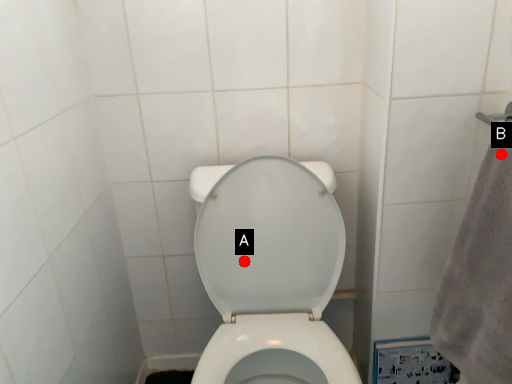
Question: Two points are circled on the image, labeled by A and B beside each circle. Which point appears closest to the camera in this image?

Choices:
 (A) A is closer
 (B) B is closer

Answer: (B)